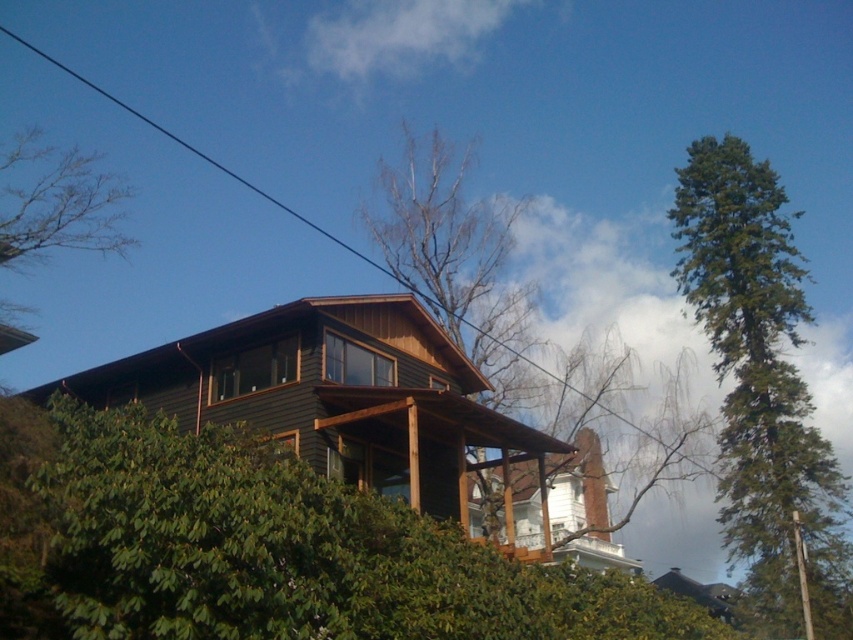
Question: Is green textured tree at right positioned before bare wood tree at center?

Choices:
 (A) yes
 (B) no

Answer: (B)

Question: Among these objects, which one is farthest from the camera?

Choices:
 (A) bare wood tree at center
 (B) green matte tree at lower left
 (C) green textured tree at right

Answer: (C)

Question: In this image, where is green textured tree at right located relative to bare wood tree at center?

Choices:
 (A) below
 (B) above

Answer: (B)

Question: Is green textured tree at right below bare wood tree at center?

Choices:
 (A) no
 (B) yes

Answer: (A)

Question: Which object appears closest to the camera in this image?

Choices:
 (A) green textured tree at right
 (B) green matte tree at lower left
 (C) bare wood tree at center

Answer: (B)

Question: Among these points, which one is nearest to the camera?

Choices:
 (A) click(416, 252)
 (B) click(35, 480)

Answer: (B)